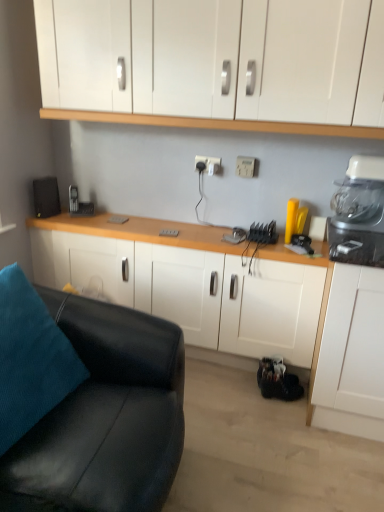
Question: From the image's perspective, is white matte cabinet at center, the first cabinetry ordered from the bottom, positioned above or below black leather couch at lower left?

Choices:
 (A) below
 (B) above

Answer: (B)

Question: In the image, is white matte cabinet at center, positioned as the second cabinetry in top-to-bottom order, on the left side or the right side of black leather couch at lower left?

Choices:
 (A) left
 (B) right

Answer: (B)

Question: Which is farther from the white plastic blender at upper right?

Choices:
 (A) white plastic electric outlet at center, which appears as the 2th electric outlet when viewed from the left
 (B) black leather couch at lower left
 (C) white glossy cabinets at upper center, which is counted as the second cabinetry, starting from the bottom
 (D) white plastic electric outlet at center, the first electric outlet when ordered from left to right
 (E) teal fabric pillow at lower left

Answer: (E)

Question: Which is nearer to the white matte cabinet at center, the first cabinetry ordered from the bottom?

Choices:
 (A) white plastic electric outlet at center, the first electric outlet when ordered from left to right
 (B) white glossy cabinets at upper center, the first cabinetry when ordered from top to bottom
 (C) white plastic electric outlet at center, acting as the first electric outlet starting from the right
 (D) yellow matte plastic container at right
 (E) white plastic blender at upper right

Answer: (E)